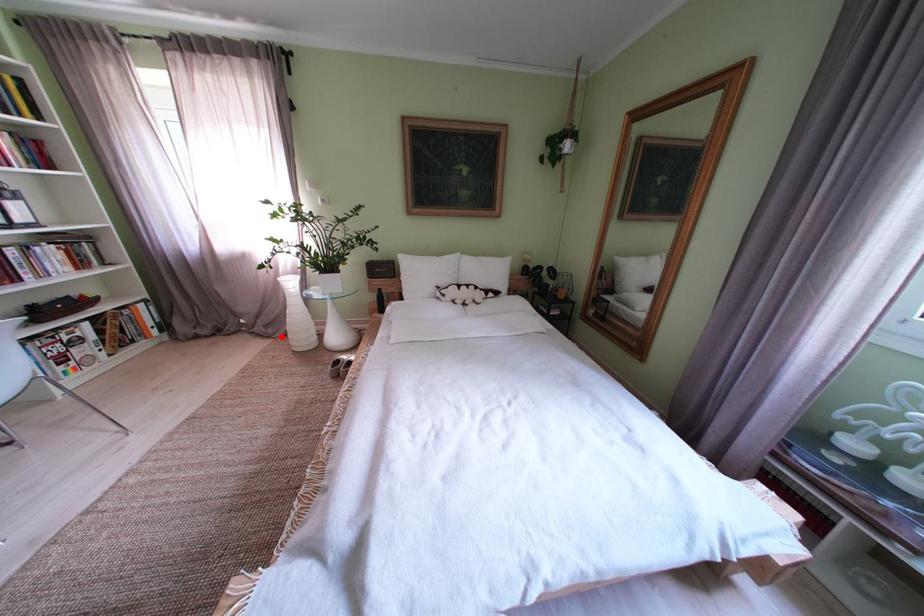
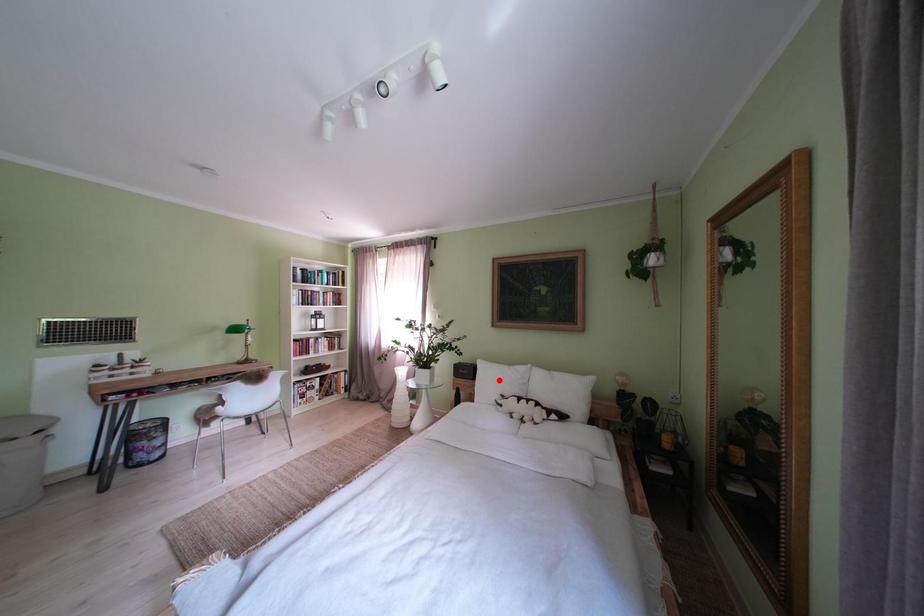
I am providing you with two images of the same scene from different viewpoints. A red point is marked on the first image and another point is marked on the second image. Do the highlighted points in image1 and image2 indicate the same real-world spot?

No